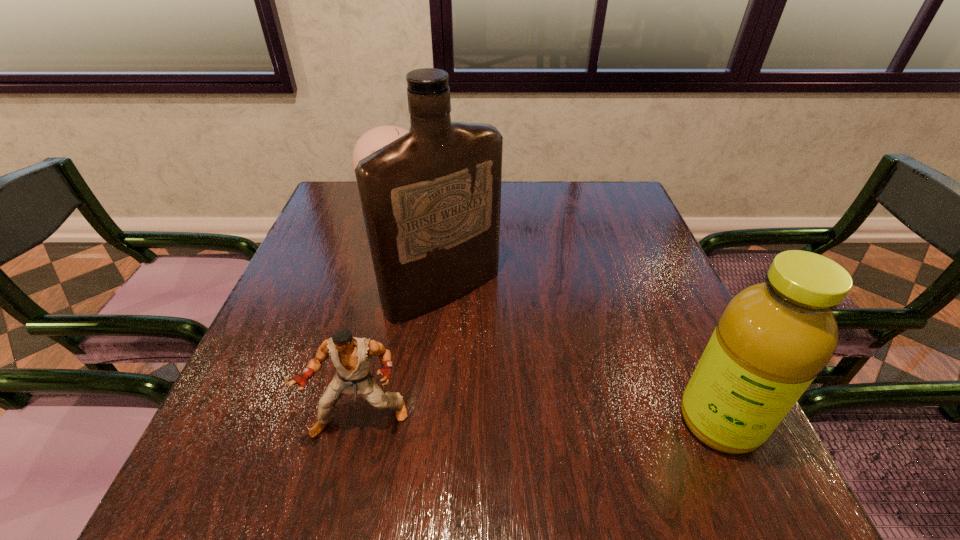
At what (x,y) coordinates should I click in order to perform the action: click on puncher. Please return your answer as a coordinate pair (x, y). The height and width of the screenshot is (540, 960). Looking at the image, I should click on (351, 356).

You are a GUI agent. You are given a task and a screenshot of the screen. Output one action in this format:
    pyautogui.click(x=<x>, y=<y>)
    Task: Click on the rightmost object
    This screenshot has width=960, height=540.
    Given the screenshot: What is the action you would take?
    pyautogui.click(x=773, y=338)

This screenshot has height=540, width=960. In order to click on fruit juice in this screenshot , I will do `click(773, 338)`.

This screenshot has width=960, height=540. I want to click on liquor, so click(431, 199).

At what (x,y) coordinates should I click in order to perform the action: click on the tallest object. Please return your answer as a coordinate pair (x, y). Looking at the image, I should click on (431, 199).

At what (x,y) coordinates should I click in order to perform the action: click on piggy bank. Please return your answer as a coordinate pair (x, y). This screenshot has width=960, height=540. Looking at the image, I should click on (374, 139).

Identify the location of vacant point located 0.190m on the label side of the tallest object. The image size is (960, 540). (536, 375).

Find the location of a particular element. This screenshot has width=960, height=540. free space located 0.110m on the label side of the tallest object is located at coordinates coord(509,349).

Locate an element on the screen. The image size is (960, 540). free space located 0.310m on the label side of the tallest object is located at coordinates (582, 421).

Where is `vacant region located 0.140m at the snout of the piggy bank`? vacant region located 0.140m at the snout of the piggy bank is located at coordinates (426, 253).